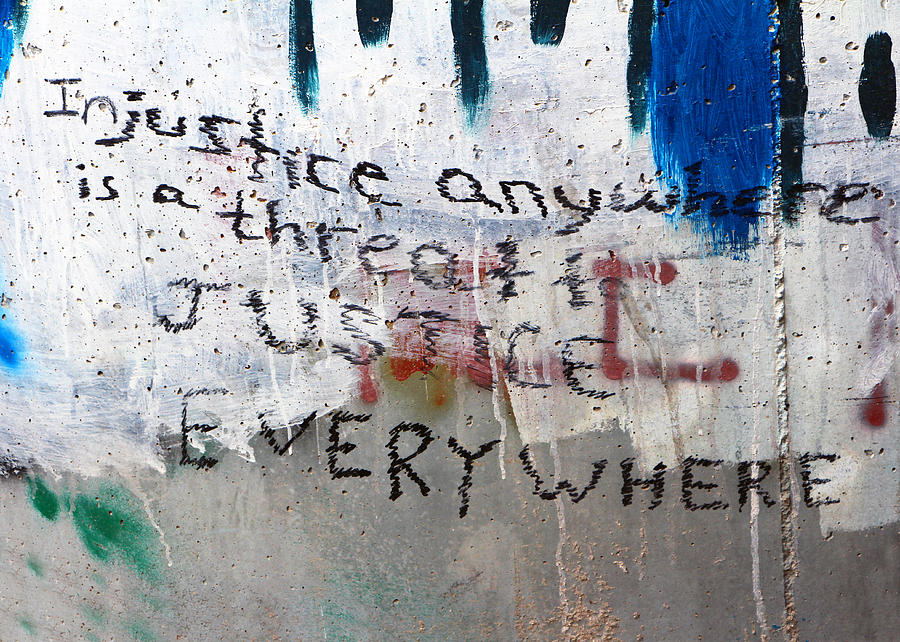
Find the location of a particular element. green paint is located at coordinates (121, 549).